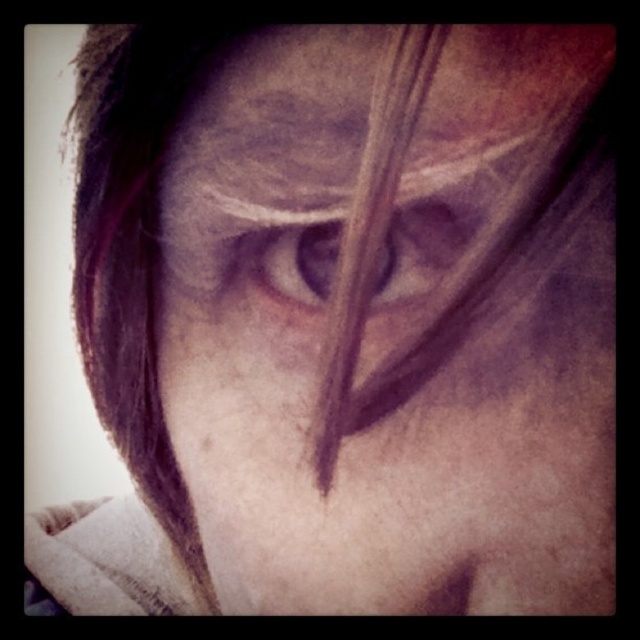
Does matte skin at center appear on the right side of brown matte eye at center?

Correct, you'll find matte skin at center to the right of brown matte eye at center.

Which is in front, point (472, 74) or point (273, 289)?

Point (472, 74) is more forward.

Where is `matte skin at center`? Image resolution: width=640 pixels, height=640 pixels. matte skin at center is located at coordinates tap(406, 81).

Is brown matte eye at center taller than matte skin eye at center?

Correct, brown matte eye at center is much taller as matte skin eye at center.

Can you confirm if brown matte eye at center is wider than matte skin eye at center?

Correct, the width of brown matte eye at center exceeds that of matte skin eye at center.

The image size is (640, 640). Describe the element at coordinates (294, 250) in the screenshot. I see `brown matte eye at center` at that location.

Find the location of a particular element. brown matte eye at center is located at coordinates (294, 250).

Can you confirm if matte skin at center is taller than matte skin eye at center?

Indeed, matte skin at center has a greater height compared to matte skin eye at center.

Image resolution: width=640 pixels, height=640 pixels. I want to click on matte skin at center, so click(x=406, y=81).

Identify the location of matte skin at center. The width and height of the screenshot is (640, 640). point(406,81).